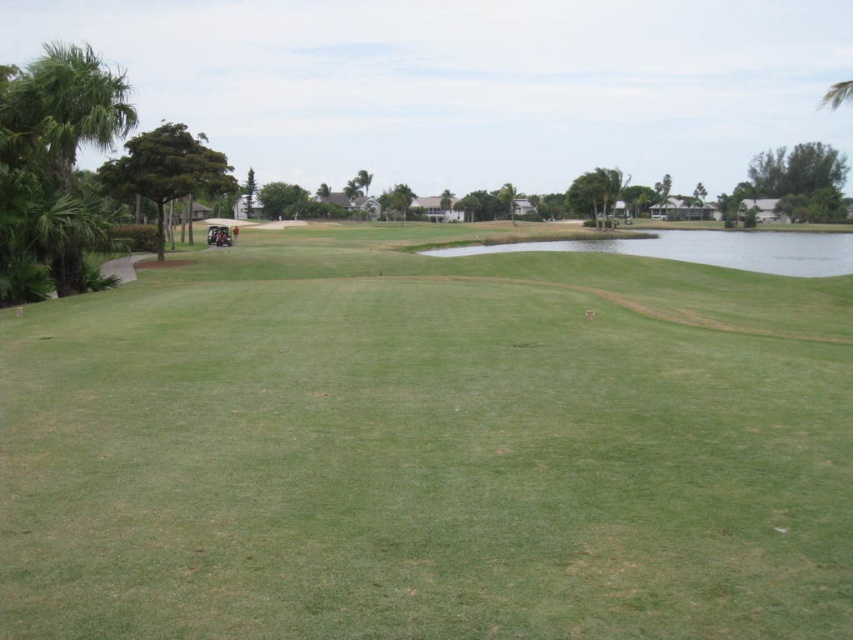
Based on the coordinates provided, where exactly is the green grassy golf course at center located in the image?

The green grassy golf course at center is located at point 0.703 on the x axis and 0.502 on the y axis.